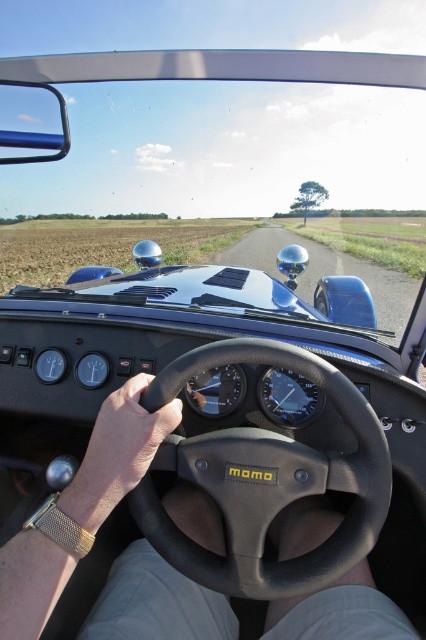
What do you see at coordinates (267, 481) in the screenshot?
I see `black leather steering wheel at center` at bounding box center [267, 481].

Which of these two, black leather steering wheel at center or leather at center, stands shorter?

leather at center is shorter.

Is point (169, 456) farther from camera compared to point (164, 429)?

Yes.

Find the location of a particular element. The height and width of the screenshot is (640, 426). black leather steering wheel at center is located at coordinates (267, 481).